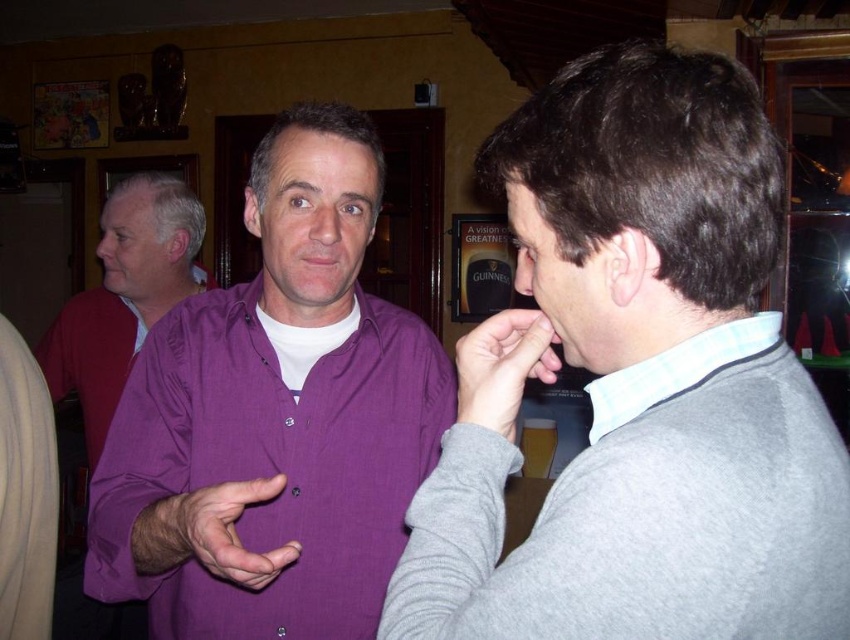
Question: Estimate the real-world distances between objects in this image. Which object is closer to the purple satin shirt at center?

Choices:
 (A) purple matte shirt at center
 (B) white textured shirt at center
 (C) purple cotton shirt at center
 (D) gray sweater at right

Answer: (C)

Question: Considering the relative positions of gray sweater at right and purple cotton shirt at center in the image provided, where is gray sweater at right located with respect to purple cotton shirt at center?

Choices:
 (A) right
 (B) left

Answer: (A)

Question: Among these objects, which one is farthest from the camera?

Choices:
 (A) purple matte shirt at center
 (B) matte gray sweater at center

Answer: (A)

Question: Is white textured shirt at center closer to camera compared to matte gray sweater at center?

Choices:
 (A) yes
 (B) no

Answer: (A)

Question: Does purple cotton shirt at center have a smaller size compared to white textured shirt at center?

Choices:
 (A) no
 (B) yes

Answer: (A)

Question: Considering the real-world distances, which object is farthest from the purple cotton shirt at center?

Choices:
 (A) gray sweater at right
 (B) purple satin shirt at center
 (C) purple matte shirt at center
 (D) matte gray sweater at center

Answer: (B)